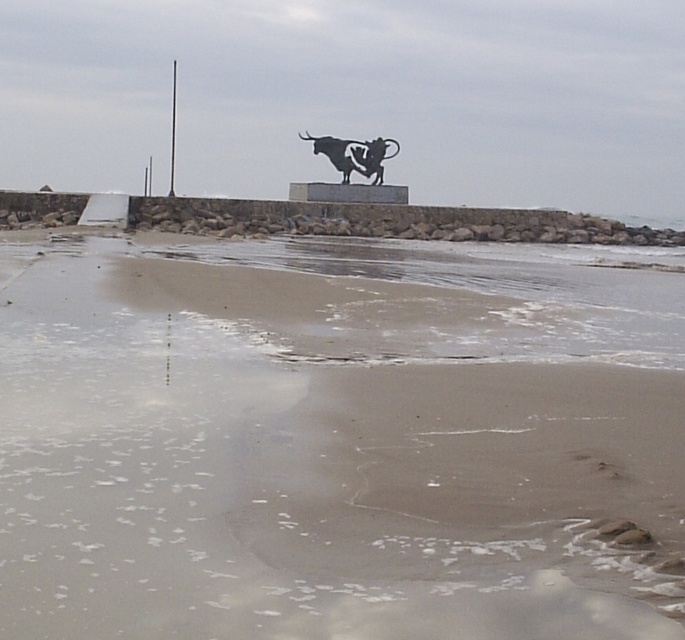
Does point (95, 353) come farther from viewer compared to point (171, 122)?

That is False.

Who is higher up, sandy at center or smooth metal pole at upper center?

smooth metal pole at upper center is higher up.

Locate an element on the screen. Image resolution: width=685 pixels, height=640 pixels. sandy at center is located at coordinates (334, 442).

What are the coordinates of `sandy at center` in the screenshot? It's located at pyautogui.click(x=334, y=442).

Can you confirm if sandy at center is bigger than black metal bull at upper center?

Indeed, sandy at center has a larger size compared to black metal bull at upper center.

Can you confirm if sandy at center is smaller than black metal bull at upper center?

Actually, sandy at center might be larger than black metal bull at upper center.

I want to click on sandy at center, so click(x=334, y=442).

Identify the location of sandy at center. Image resolution: width=685 pixels, height=640 pixels. (334, 442).

Between black metal bull at upper center and smooth metal pole at upper center, which one has more height?

With more height is smooth metal pole at upper center.

Is point (345, 182) farther from camera compared to point (171, 140)?

No, (345, 182) is closer to viewer.

This screenshot has height=640, width=685. Identify the location of black metal bull at upper center. (353, 154).